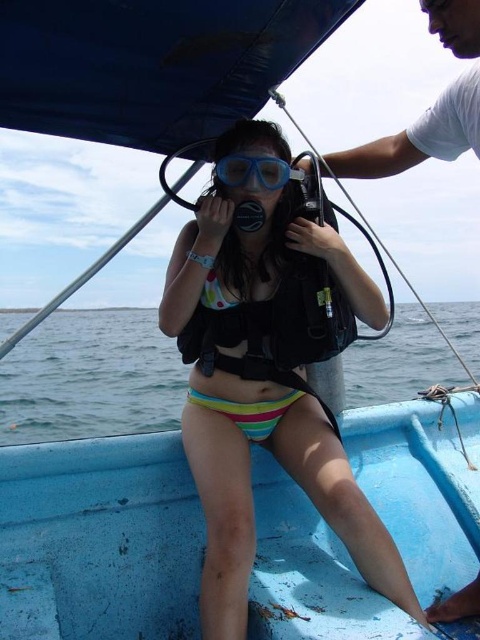
Who is shorter, white cotton shirt at upper right or blue matte scuba mask at center?

blue matte scuba mask at center is shorter.

Is point (343, 166) less distant than point (254, 156)?

No, it is not.

I want to click on white cotton shirt at upper right, so click(419, 136).

Between multicolored bikini at center and white cotton shirt at upper right, which one has less height?

With less height is white cotton shirt at upper right.

Does multicolored bikini at center appear on the left side of white cotton shirt at upper right?

Correct, you'll find multicolored bikini at center to the left of white cotton shirt at upper right.

Where is `multicolored bikini at center`? This screenshot has height=640, width=480. multicolored bikini at center is located at coordinates (267, 381).

Can you confirm if clear blue water at center is taller than multicolored fabric bikini at center?

Correct, clear blue water at center is much taller as multicolored fabric bikini at center.

Does clear blue water at center have a lesser height compared to multicolored fabric bikini at center?

Incorrect, clear blue water at center's height does not fall short of multicolored fabric bikini at center's.

Who is more forward, (37, 401) or (225, 301)?

Point (225, 301)

Find the location of a particular element. The height and width of the screenshot is (640, 480). clear blue water at center is located at coordinates (91, 378).